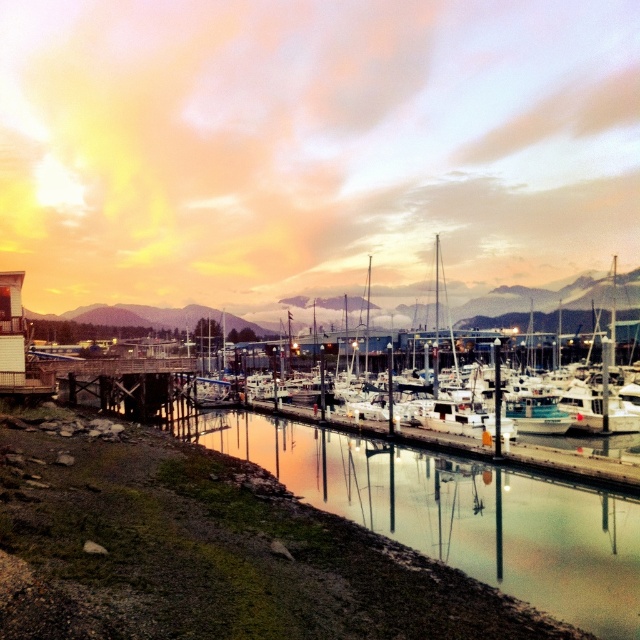
Is white matte boat at center shorter than wooden dock at lower left?

No, white matte boat at center is not shorter than wooden dock at lower left.

Can you confirm if white matte boat at center is wider than wooden dock at lower left?

Indeed, white matte boat at center has a greater width compared to wooden dock at lower left.

Measure the distance between point (x=625, y=353) and camera.

Point (x=625, y=353) and camera are 91.47 meters apart from each other.

The width and height of the screenshot is (640, 640). Find the location of `white matte boat at center`. white matte boat at center is located at coordinates (540, 310).